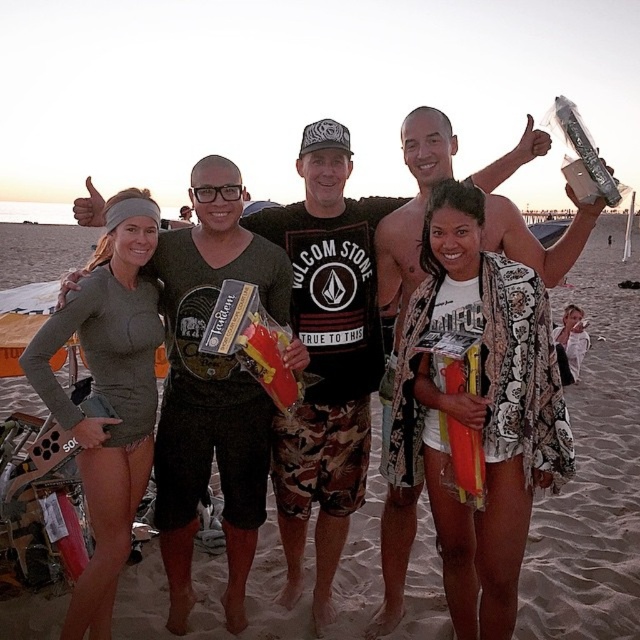
Question: Which of the following is the closest to the observer?

Choices:
 (A) (492, 234)
 (B) (193, 497)

Answer: (A)

Question: Based on their relative distances, which object is nearer to the camouflage shorts at center?

Choices:
 (A) matte black t-shirt at center
 (B) matte black shirt at center

Answer: (A)

Question: Does matte black shirt at center appear over matte black t-shirt at center?

Choices:
 (A) no
 (B) yes

Answer: (A)

Question: Can you confirm if matte black shirt at center is thinner than camouflage shorts at center?

Choices:
 (A) yes
 (B) no

Answer: (A)

Question: Is camouflage shorts at center thinner than matte black t-shirt at center?

Choices:
 (A) yes
 (B) no

Answer: (B)

Question: Which point is farther to the camera?

Choices:
 (A) (324, 397)
 (B) (268, 291)
 (C) (419, 160)

Answer: (A)